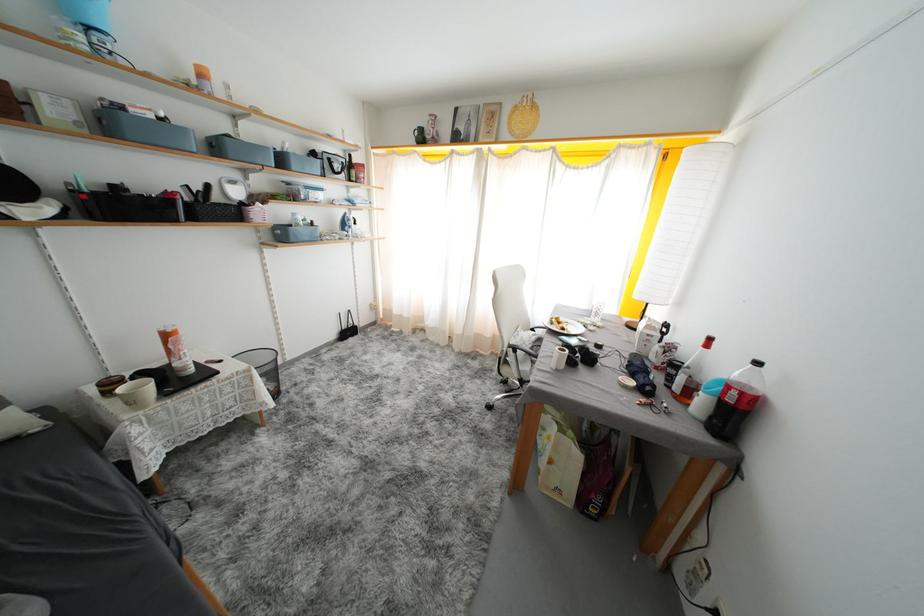
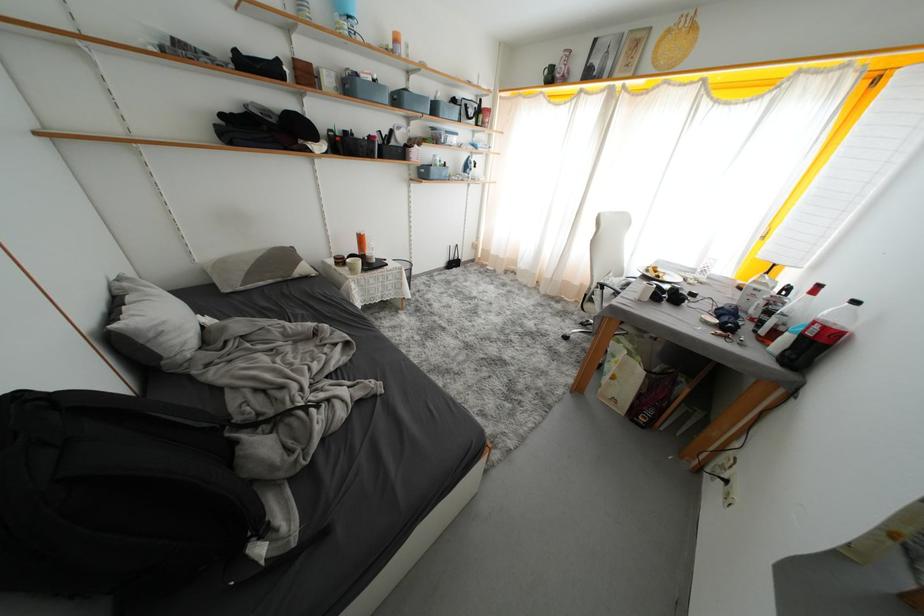
The point at (x=676, y=382) is marked in the first image. Where is the corresponding point in the second image?

(767, 328)